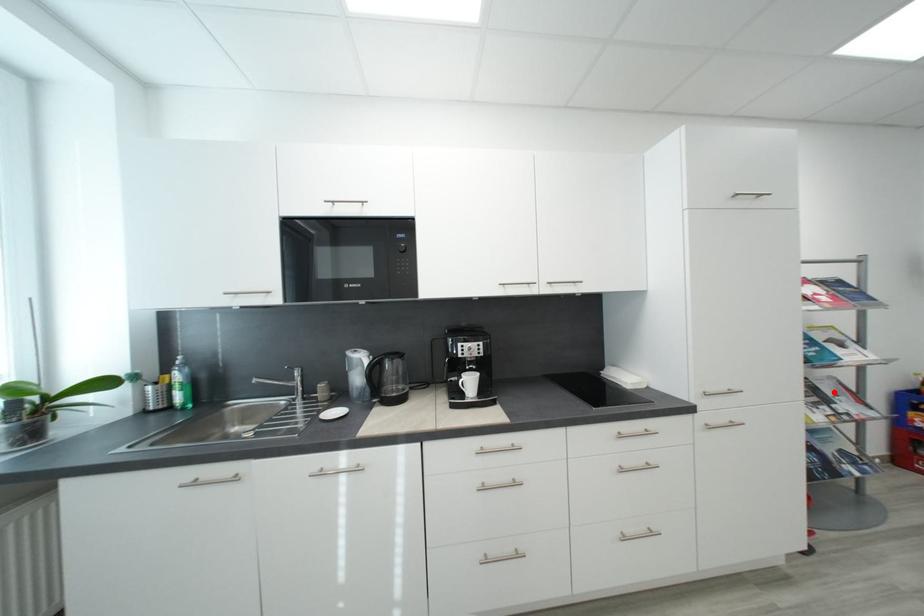
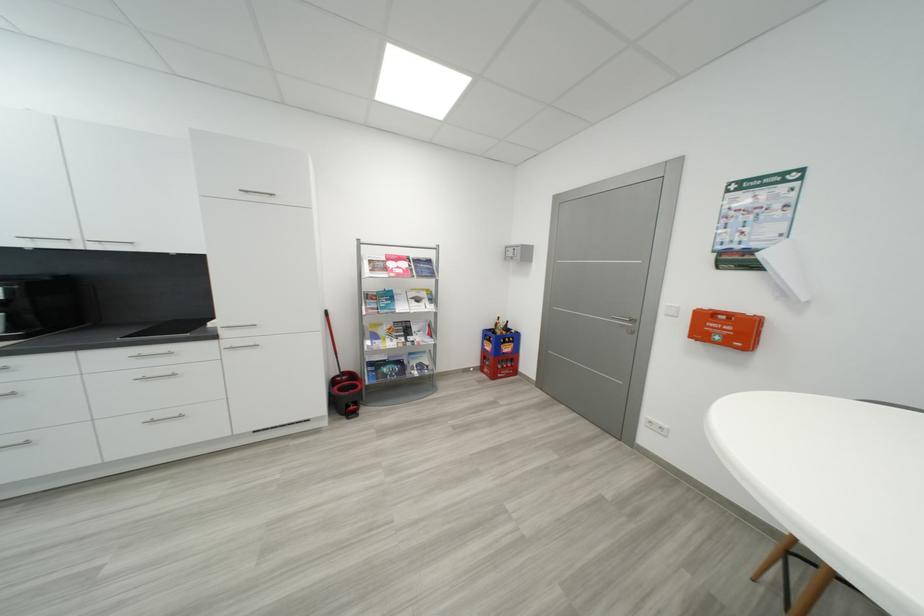
Question: A red point is marked in image1. In image2, is the corresponding 3D point closer to the camera or farther? Reply with the corresponding letter.

Choices:
 (A) The corresponding 3D point is closer.
 (B) The corresponding 3D point is farther.

Answer: (B)